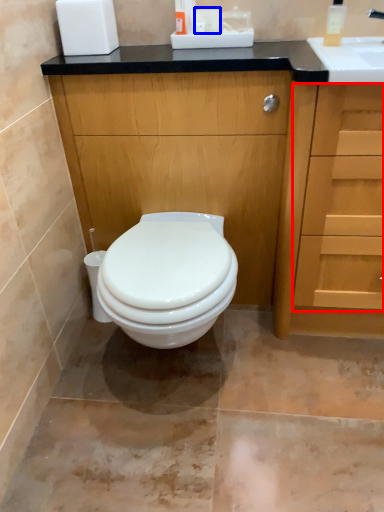
Question: Which object is closer to the camera taking this photo, drawer (highlighted by a red box) or toilet paper (highlighted by a blue box)?

Choices:
 (A) drawer
 (B) toilet paper

Answer: (A)